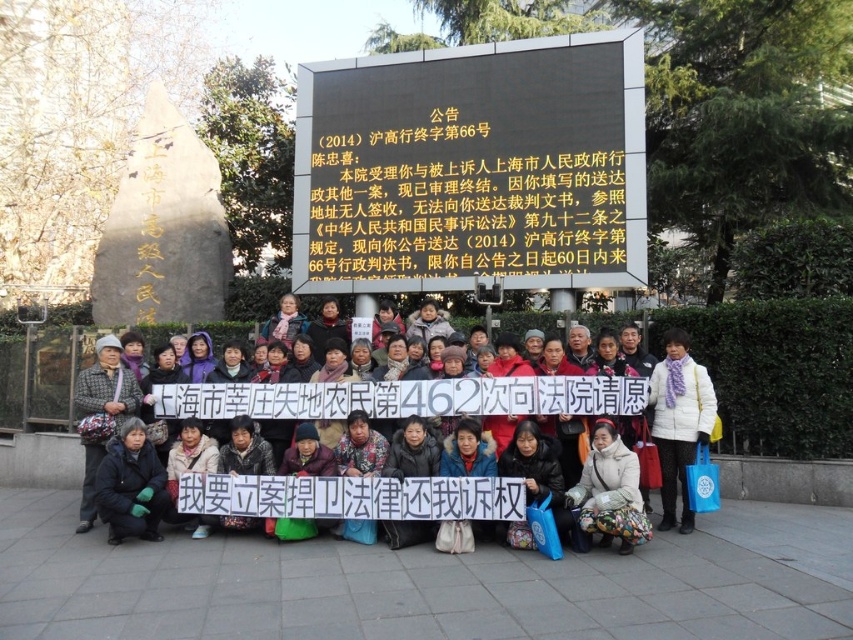
You are a photographer standing at the origin point of the image coordinate system. You want to take a photo of the dark gray winter coat at center. What are the 2D coordinates where you should aim your camera?

The dark gray winter coat at center is located at the 2D coordinates of point (416, 396), so you should aim your camera at those coordinates to capture it.

You are a photographer trying to capture the protest scene. You need to ensure both the black lcd screen at upper center and the white woolen scarf at center are clearly visible in your photo. Given their sizes, which object should you focus on first to ensure it is in frame?

The black lcd screen at upper center is much taller than the white woolen scarf at center, so you should focus on ensuring the black lcd screen at upper center is in frame first since it occupies more space and might require more attention to capture fully.

You are a photographer standing at the center of the protest area. You want to take a photo that includes both the banner held by the protesters and the monument in the background. Which of the two points, point (368, 131) or point (192, 388), is closer to you and thus more likely to be in focus if you focus on the monument?

Point (192, 388) is closer to you than point (368, 131). If you focus on the monument, which is further away, the point closer to you, point (192, 388), might be slightly out of focus depending on the camera settings.